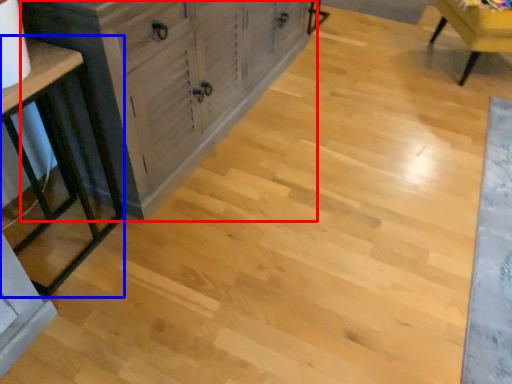
Question: Which object is closer to the camera taking this photo, cabinetry (highlighted by a red box) or table (highlighted by a blue box)?

Choices:
 (A) cabinetry
 (B) table

Answer: (B)